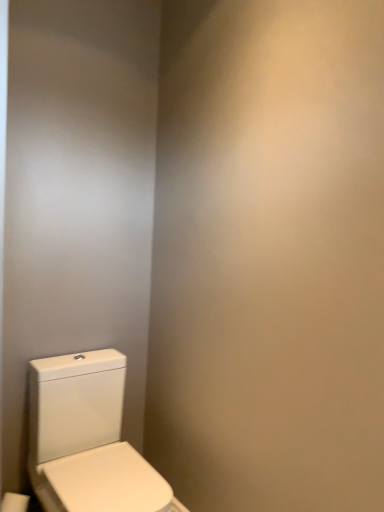
Question: Should I look upward or downward to see white glossy toilet at lower left?

Choices:
 (A) down
 (B) up

Answer: (A)